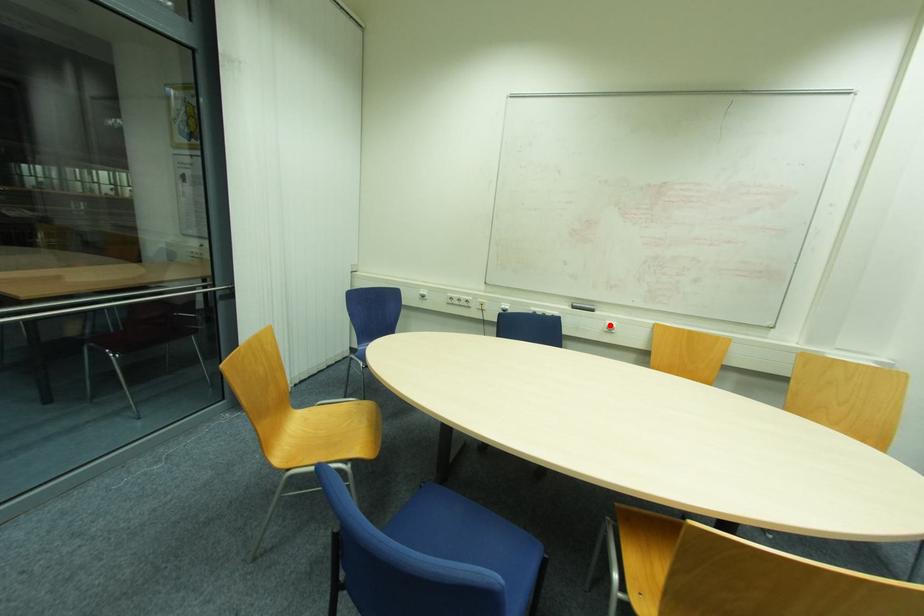
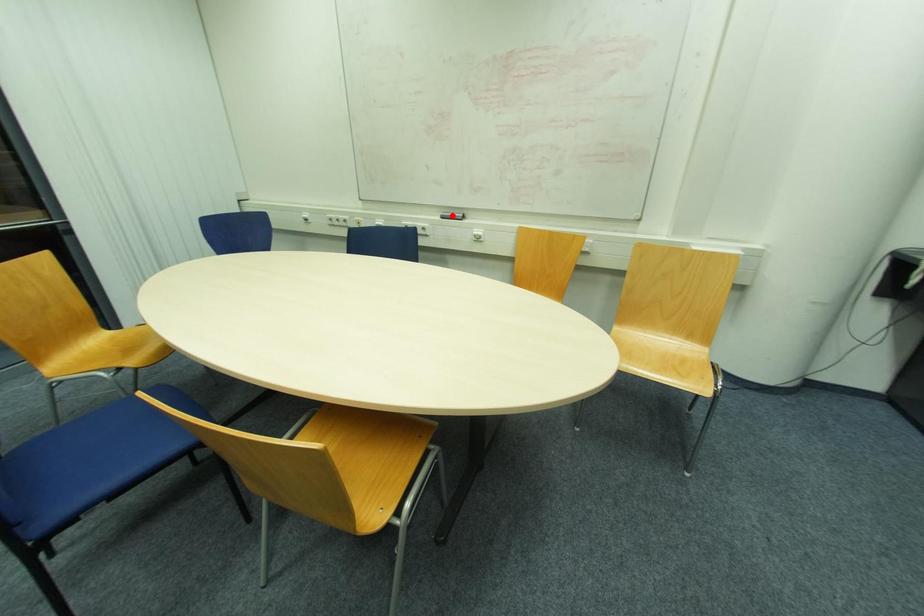
I am providing you with two images of the same scene from different viewpoints. A red point is marked on the first image and another point is marked on the second image. Do the highlighted points in image1 and image2 indicate the same real-world spot?

No